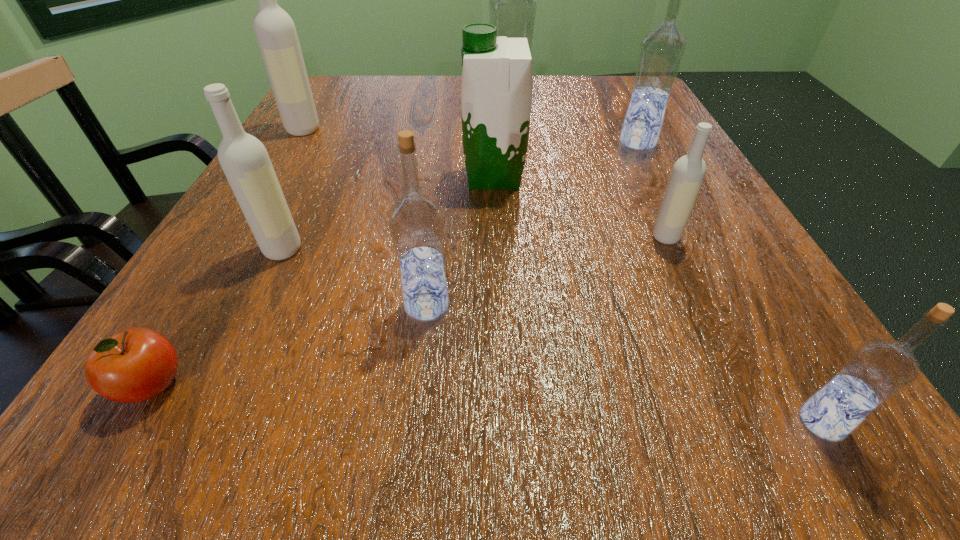
Find the location of `the second nearest blue vodka`. the second nearest blue vodka is located at coordinates (416, 222).

Locate an element on the screen. The height and width of the screenshot is (540, 960). the rightmost white vodka is located at coordinates (688, 172).

Image resolution: width=960 pixels, height=540 pixels. Identify the location of the nearest vodka. (877, 370).

Where is `the nearest blue vodka`? Image resolution: width=960 pixels, height=540 pixels. the nearest blue vodka is located at coordinates (877, 370).

You are a GUI agent. You are given a task and a screenshot of the screen. Output one action in this format:
    pyautogui.click(x=<x>, y=<y>)
    Task: Click on the shortest object
    
    Given the screenshot: What is the action you would take?
    pyautogui.click(x=137, y=364)

The height and width of the screenshot is (540, 960). I want to click on free space located on the left of the tallest object, so click(423, 114).

Identify the location of vacant space located on the back of the farthest white vodka. This screenshot has height=540, width=960. click(x=332, y=81).

The image size is (960, 540). Find the location of `free space located 0.100m on the front of the third nearest blue vodka`. free space located 0.100m on the front of the third nearest blue vodka is located at coordinates (658, 181).

Image resolution: width=960 pixels, height=540 pixels. Find the location of `vacant space located on the front-facing side of the fourth farthest object`. vacant space located on the front-facing side of the fourth farthest object is located at coordinates (391, 177).

The width and height of the screenshot is (960, 540). I want to click on vacant region located on the front-facing side of the fourth farthest object, so click(284, 177).